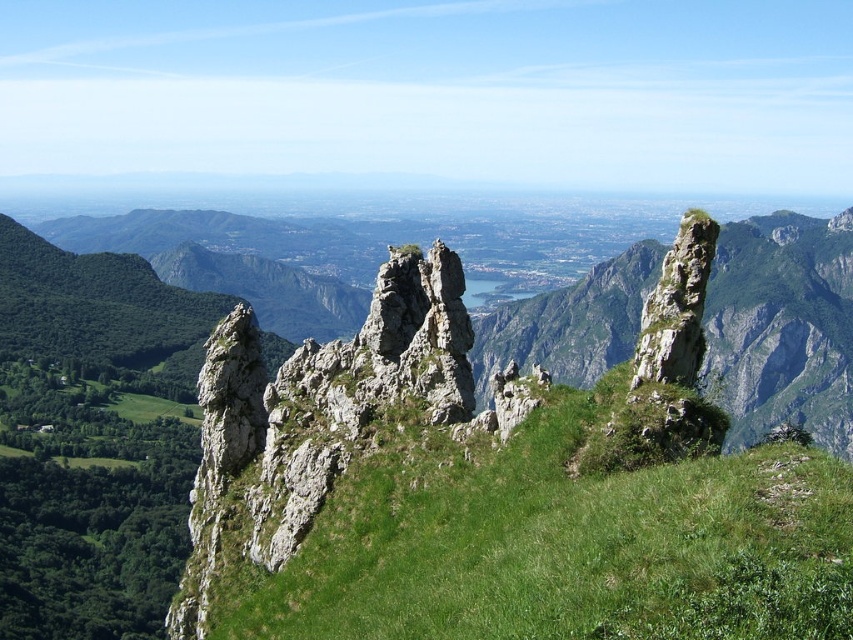
Who is taller, green grassy at center or rough stone rock at right?

green grassy at center

Is green grassy at center smaller than rough stone rock at right?

Actually, green grassy at center might be larger than rough stone rock at right.

What do you see at coordinates (566, 541) in the screenshot?
I see `green grassy at center` at bounding box center [566, 541].

The height and width of the screenshot is (640, 853). Find the location of `green grassy at center`. green grassy at center is located at coordinates coord(566,541).